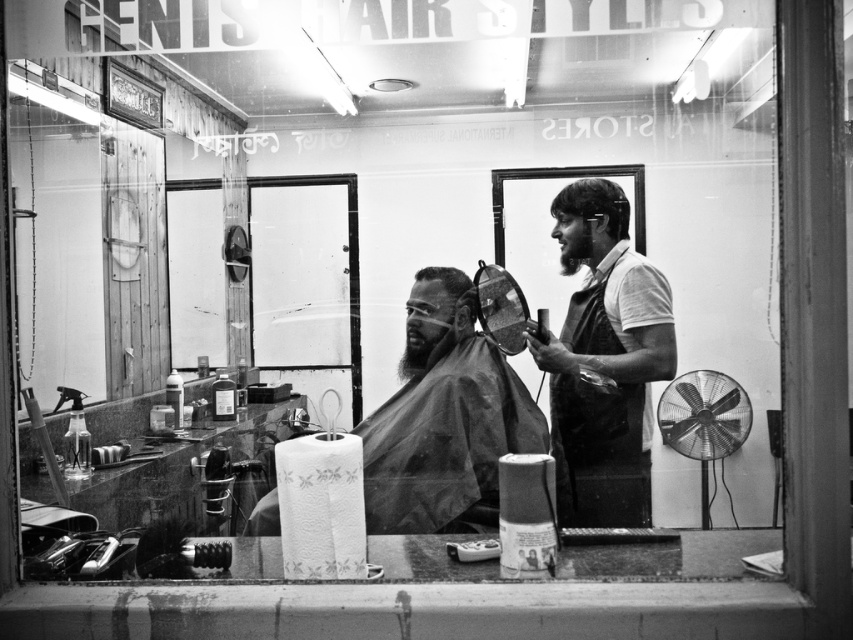
Question: Which point is farther to the camera?

Choices:
 (A) bearded man at center
 (B) short dark hair at upper right
 (C) short hair at center
 (D) black fabric apron at right

Answer: (A)

Question: Is smooth black shirt at center bigger than short dark hair at upper right?

Choices:
 (A) yes
 (B) no

Answer: (A)

Question: Is bearded man at center to the right of smooth black shirt at center from the viewer's perspective?

Choices:
 (A) no
 (B) yes

Answer: (A)

Question: Based on their relative distances, which object is farther from the short dark hair at upper right?

Choices:
 (A) bearded man at center
 (B) black fabric apron at right
 (C) short hair at center
 (D) smooth black shirt at center

Answer: (A)

Question: Which object is closer to the camera taking this photo?

Choices:
 (A) short hair at center
 (B) smooth black shirt at center
 (C) black fabric apron at right
 (D) bearded man at center

Answer: (B)

Question: Does black fabric apron at right have a smaller size compared to short hair at center?

Choices:
 (A) yes
 (B) no

Answer: (B)